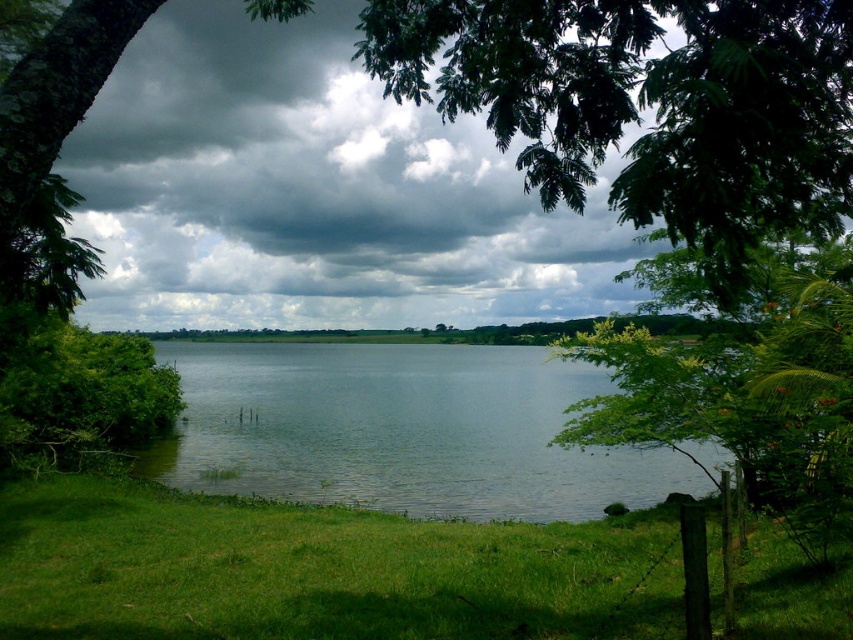
You are standing at the edge of the lake and want to take a photo of the green grass at lower left and the clear water at center. Which object will appear smaller in your photo?

The green grass at lower left will appear smaller in the photo because it has a smaller size compared to the clear water at center.

You are standing at the lakeside and want to walk from the green grass at lower left to the clear water at center. Is the path directly between them level or sloping?

The green grass at lower left is closer to the viewer than the clear water at center, indicating a sloping path from the grass to the water.